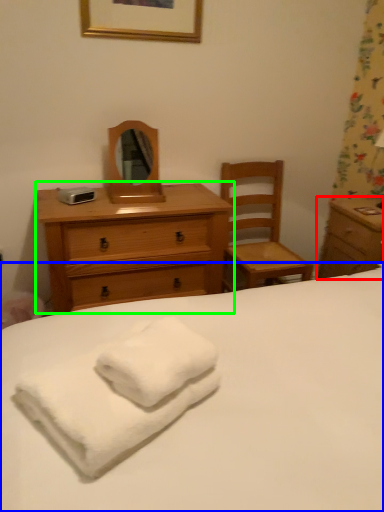
Question: Based on their relative distances, which object is nearer to nightstand (highlighted by a red box)? Choose from bed (highlighted by a blue box) and chest of drawers (highlighted by a green box).

Choices:
 (A) bed
 (B) chest of drawers

Answer: (B)